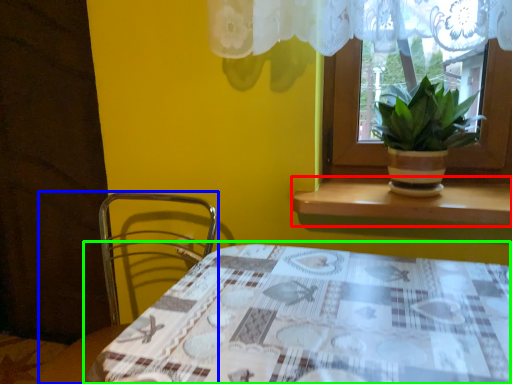
Question: Which object is positioned closest to window sill (highlighted by a red box)? Select from chair (highlighted by a blue box) and table (highlighted by a green box).

Choices:
 (A) chair
 (B) table

Answer: (B)